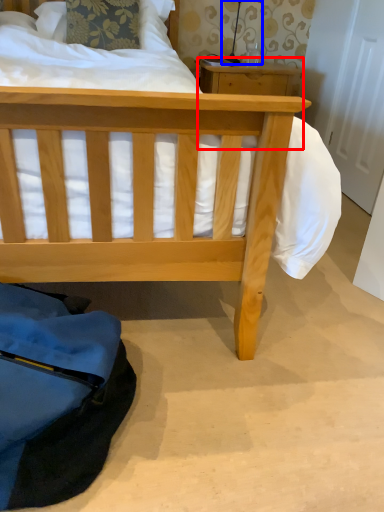
Question: Which point is closer to the camera, table (highlighted by a red box) or table lamp (highlighted by a blue box)?

Choices:
 (A) table
 (B) table lamp

Answer: (A)